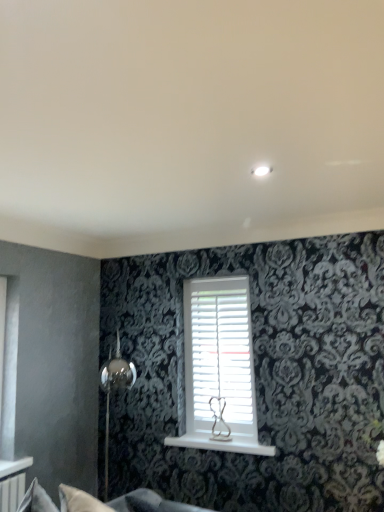
Question: Considering the positions of point (236, 323) and point (259, 443), is point (236, 323) closer or farther from the camera than point (259, 443)?

Choices:
 (A) closer
 (B) farther

Answer: (B)

Question: Considering the positions of white matte shutter at center and white glossy window sill at center in the image, is white matte shutter at center taller or shorter than white glossy window sill at center?

Choices:
 (A) tall
 (B) short

Answer: (A)

Question: Which object is positioned closest to the white matte shutter at center?

Choices:
 (A) white glossy window sill at center
 (B) soft gray fabric couch at lower left

Answer: (A)

Question: Which object is positioned closest to the white glossy window sill at center?

Choices:
 (A) soft gray fabric couch at lower left
 (B) white matte shutter at center

Answer: (B)